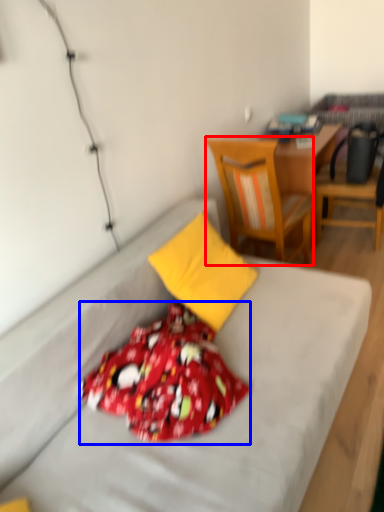
Question: Which point is further to the camera, chair (highlighted by a red box) or blanket (highlighted by a blue box)?

Choices:
 (A) chair
 (B) blanket

Answer: (A)